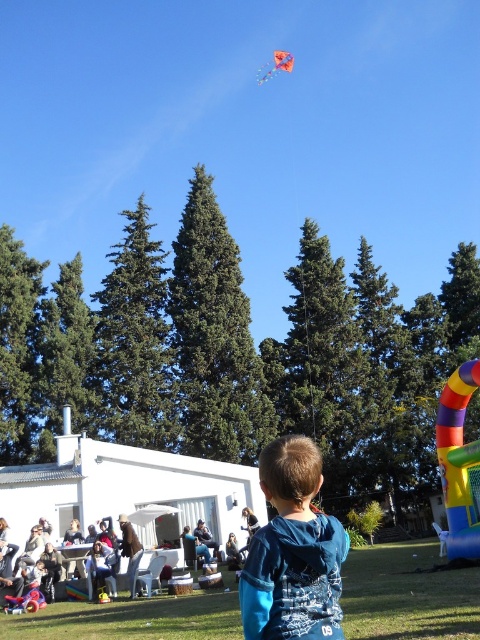
You are standing at the point labeled as point (408, 595) in the image. What is located at this point?

The point (408, 595) indicates green grass at lower center.

You are a photographer trying to capture a photo of the blue cotton shirt at lower center and the dark blue shirt at lower center. Which one is positioned higher in the frame?

The blue cotton shirt at lower center is positioned higher in the frame than the dark blue shirt at lower center.

You are a photographer trying to capture a photo of the blue cotton shirt at lower center and the green grass at lower center. Which object should you focus on first if you want to ensure both are in focus?

The green grass at lower center is below the blue cotton shirt at lower center, so you should focus on the blue cotton shirt at lower center first to ensure both are in focus.